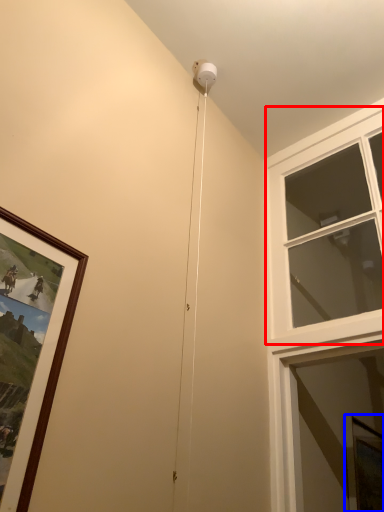
Question: Which object is closer to the camera taking this photo, window (highlighted by a red box) or window screen (highlighted by a blue box)?

Choices:
 (A) window
 (B) window screen

Answer: (A)